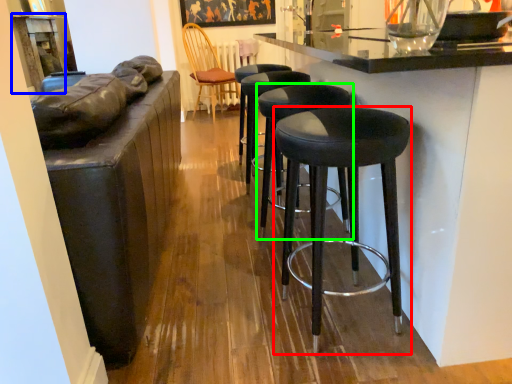
Question: Which is farther away from stool (highlighted by a red box)? table (highlighted by a blue box) or stool (highlighted by a green box)?

Choices:
 (A) table
 (B) stool

Answer: (A)